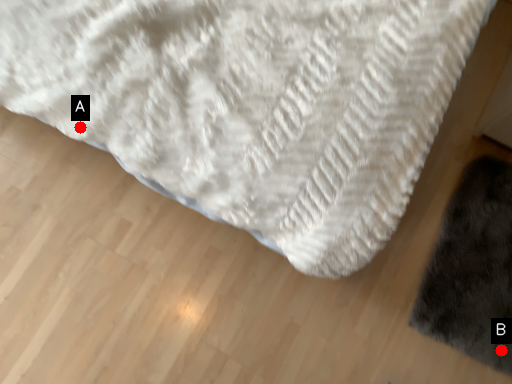
Question: Two points are circled on the image, labeled by A and B beside each circle. Which point appears farthest from the camera in this image?

Choices:
 (A) A is further
 (B) B is further

Answer: (B)